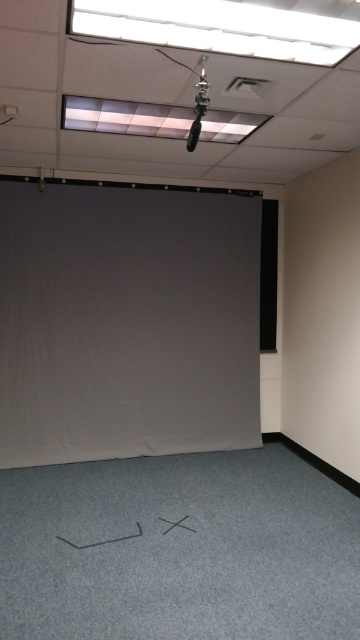
You are setting up for a presentation and need to lower the gray matte projection screen at center and the black matte projector screen at right. Which screen should you lower first to ensure proper positioning?

The gray matte projection screen at center should be lowered first since it is located below the black matte projector screen at right, so lowering it first will prevent obstruction during the setup process.

You are setting up for a presentation and need to choose between the gray matte projection screen at center and the black matte projector screen at right. Which screen is taller?

The gray matte projection screen at center is much taller than the black matte projector screen at right.

You are standing in the room and looking at the two points marked in the image. Which point, point (210, 200) or point (268, 257), is closer to you?

Point (210, 200) is closer to the camera than point (268, 257), so it is closer to you.